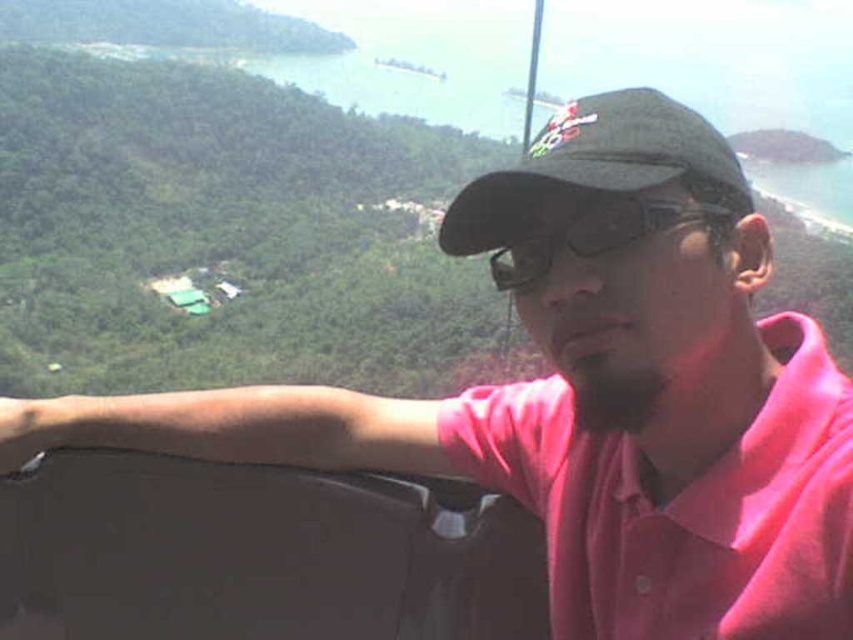
You are a photographer trying to capture the best angle of the person in the image. Since the pink cotton polo shirt at center and the black fabric baseball cap at center are both visible, which one is located more to the left side?

The pink cotton polo shirt at center is positioned on the left side of the black fabric baseball cap at center, so the pink cotton polo shirt at center is more to the left.

You are a photographer trying to capture the best angle of the person in the image. Since the pink cotton polo shirt at center and the black fabric baseball cap at center are both visible, which one do you think appears smaller in the photo?

The pink cotton polo shirt at center appears smaller in the photo because it has a lesser height compared to the black fabric baseball cap at center.